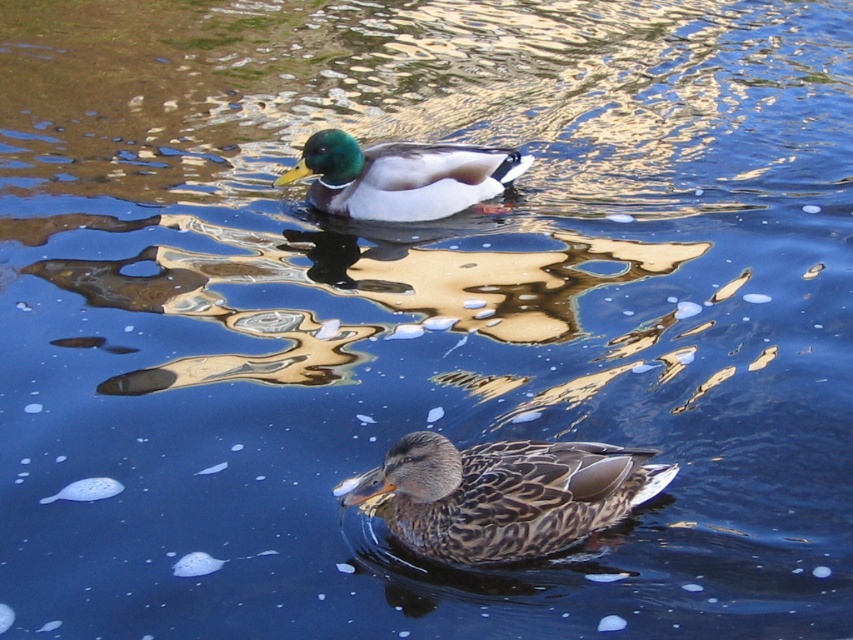
You are a wildlife photographer aiming to capture both the brown speckled feathers at center and the shiny brown duck at upper center in a single frame. Given that your camera has a 50mm lens, which has a field of view that can capture objects up to 10 feet apart, can you include both subjects in the same photograph?

The distance between the brown speckled feathers at center and the shiny brown duck at upper center is 10.93 feet, which exceeds the camera lens field of view of 10 feet. Therefore, you cannot capture both subjects in a single frame with the current lens.